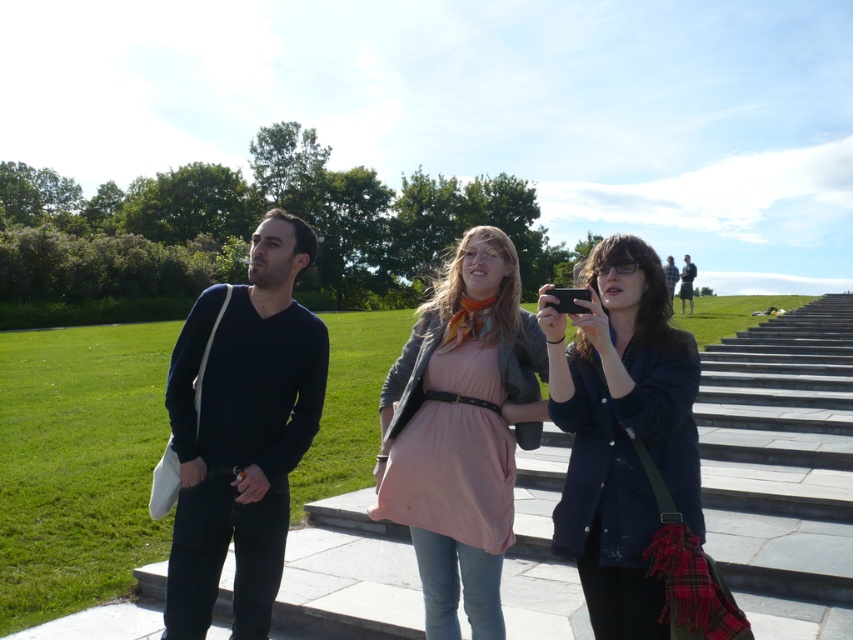
What is the color of the object located at point coordinates (621, 433) in the image?

The point at coordinates (621, 433) is on a matte black jacket at center, so the color is black.

In the scene shown: You are a photographer trying to capture a photo of the dark blue sweater at center and the pink fabric dress at center. Based on their sizes, which one should you focus on to ensure it appears more prominent in the photo?

The dark blue sweater at center is larger in size than the pink fabric dress at center, so focusing on the dark blue sweater at center will make it appear more prominent in the photo.